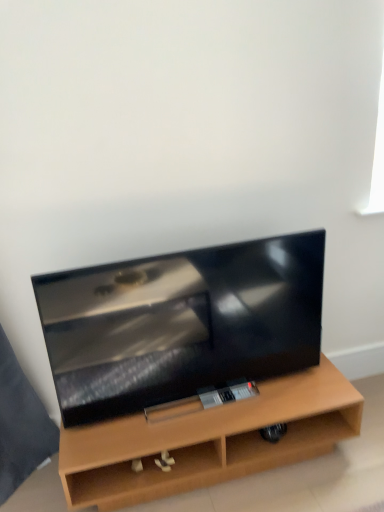
Question: Relative to matte wood tv stand at center, is matte black tv at center in front or behind?

Choices:
 (A) front
 (B) behind

Answer: (A)

Question: In terms of size, does matte black tv at center appear bigger or smaller than matte wood tv stand at center?

Choices:
 (A) small
 (B) big

Answer: (A)

Question: From a real-world perspective, is matte black tv at center above or below matte wood tv stand at center?

Choices:
 (A) above
 (B) below

Answer: (A)

Question: Is point pyautogui.click(x=299, y=438) closer or farther from the camera than point pyautogui.click(x=291, y=300)?

Choices:
 (A) farther
 (B) closer

Answer: (A)

Question: From a real-world perspective, relative to matte black tv at center, is matte wood tv stand at center vertically above or below?

Choices:
 (A) below
 (B) above

Answer: (A)

Question: From their relative heights in the image, would you say matte wood tv stand at center is taller or shorter than matte black tv at center?

Choices:
 (A) tall
 (B) short

Answer: (B)

Question: In the image, is matte wood tv stand at center positioned in front of or behind matte black tv at center?

Choices:
 (A) front
 (B) behind

Answer: (B)